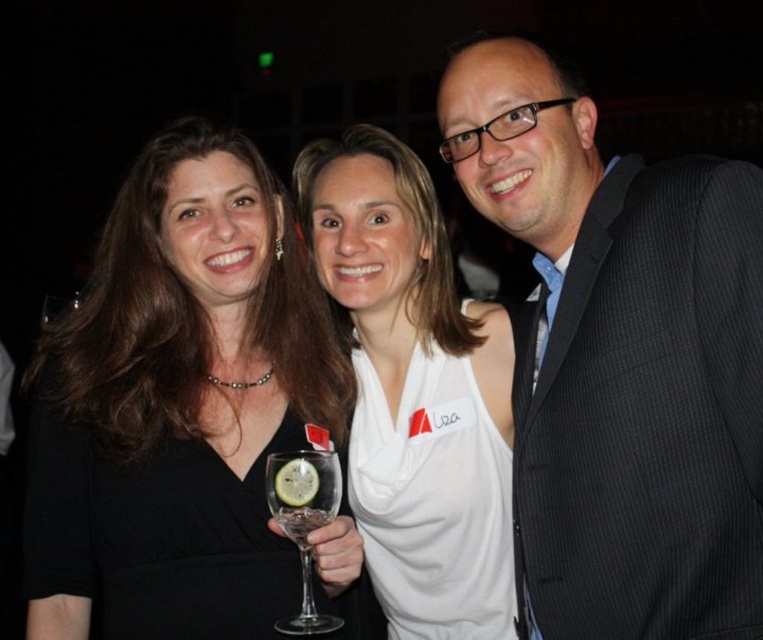
Based on the scene description, which clothing item is bigger in size between the dark gray pinstripe suit at center and the white matte tank top at center?

The dark gray pinstripe suit at center is larger in size compared to the white matte tank top at center according to the description.

Based on the scene description, which clothing item is bigger in size between the black matte dress at center and the white matte tank top at center?

The black matte dress at center is larger in size than the white matte tank top at center.